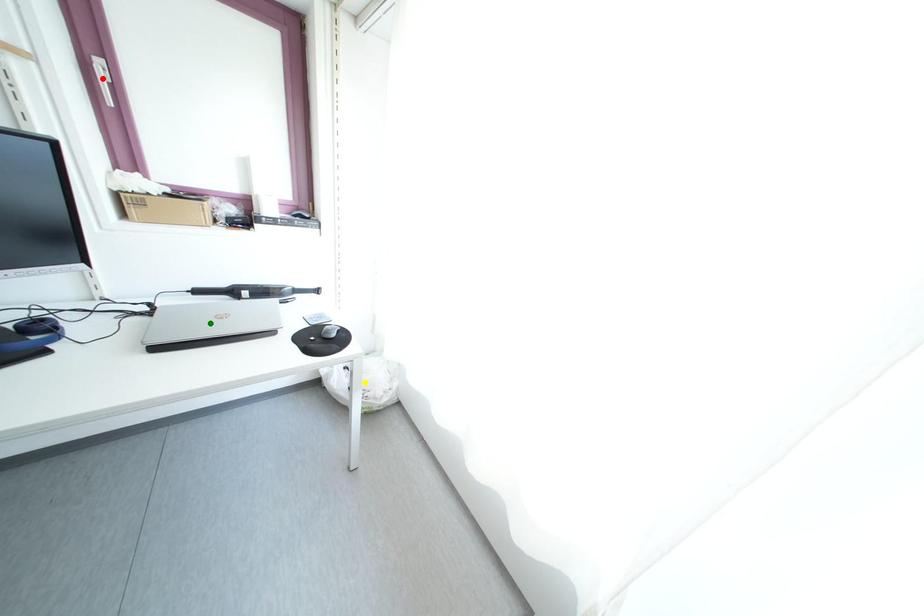
Order these from farthest to nearest:
A) green point
B) red point
C) yellow point

yellow point, green point, red point